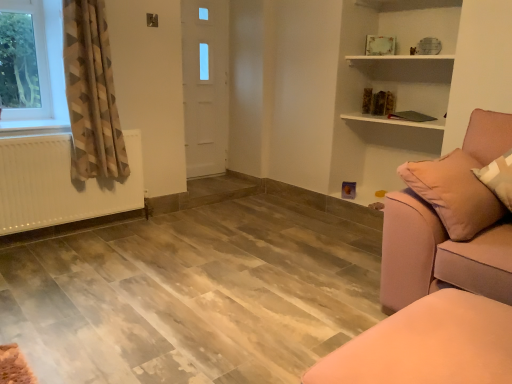
Question: Is geometric-patterned fabric curtain at left located outside white matte radiator at left?

Choices:
 (A) no
 (B) yes

Answer: (B)

Question: From a real-world perspective, is geometric-patterned fabric curtain at left on top of white matte radiator at left?

Choices:
 (A) yes
 (B) no

Answer: (A)

Question: Can you confirm if geometric-patterned fabric curtain at left is wider than white matte radiator at left?

Choices:
 (A) no
 (B) yes

Answer: (B)

Question: Is geometric-patterned fabric curtain at left directly adjacent to white matte radiator at left?

Choices:
 (A) yes
 (B) no

Answer: (B)

Question: Is white matte radiator at left located within geometric-patterned fabric curtain at left?

Choices:
 (A) yes
 (B) no

Answer: (B)

Question: Would you say white matte radiator at left is to the left or to the right of geometric-patterned fabric curtain at left in the picture?

Choices:
 (A) right
 (B) left

Answer: (B)

Question: Is white matte radiator at left inside or outside of geometric-patterned fabric curtain at left?

Choices:
 (A) outside
 (B) inside

Answer: (A)

Question: Relative to geometric-patterned fabric curtain at left, is white matte radiator at left in front or behind?

Choices:
 (A) behind
 (B) front

Answer: (A)

Question: From a real-world perspective, relative to geometric-patterned fabric curtain at left, is white matte radiator at left vertically above or below?

Choices:
 (A) above
 (B) below

Answer: (B)

Question: From a real-world perspective, is satin pink couch at right positioned above or below pink fabric ottoman at lower right?

Choices:
 (A) below
 (B) above

Answer: (B)

Question: From the image's perspective, relative to pink fabric ottoman at lower right, is satin pink couch at right above or below?

Choices:
 (A) below
 (B) above

Answer: (B)

Question: Is satin pink couch at right taller or shorter than pink fabric ottoman at lower right?

Choices:
 (A) short
 (B) tall

Answer: (B)

Question: Is satin pink couch at right spatially inside pink fabric ottoman at lower right, or outside of it?

Choices:
 (A) outside
 (B) inside

Answer: (A)

Question: Considering the positions of white matte radiator at left and satin pink couch at right in the image, is white matte radiator at left taller or shorter than satin pink couch at right?

Choices:
 (A) tall
 (B) short

Answer: (B)

Question: Is white matte radiator at left inside or outside of satin pink couch at right?

Choices:
 (A) outside
 (B) inside

Answer: (A)